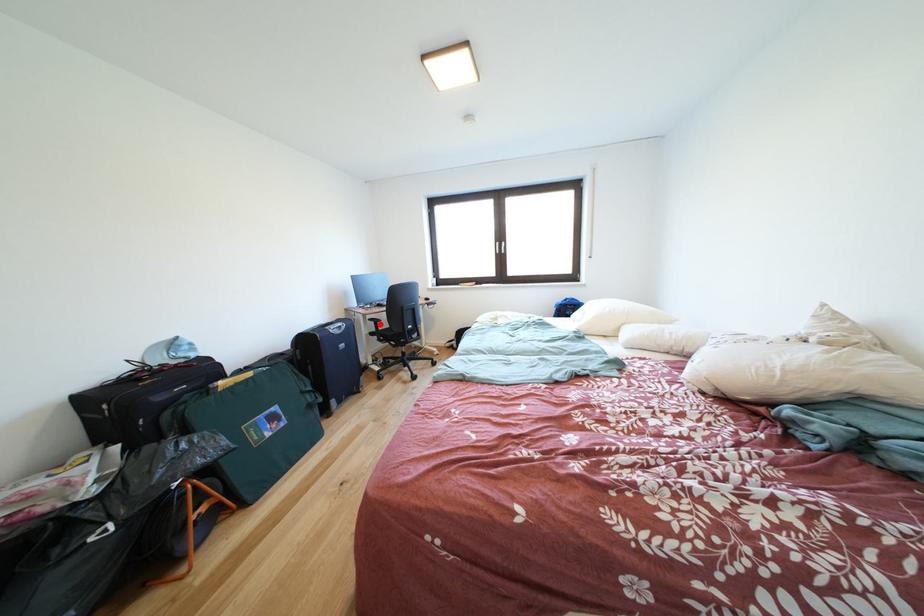
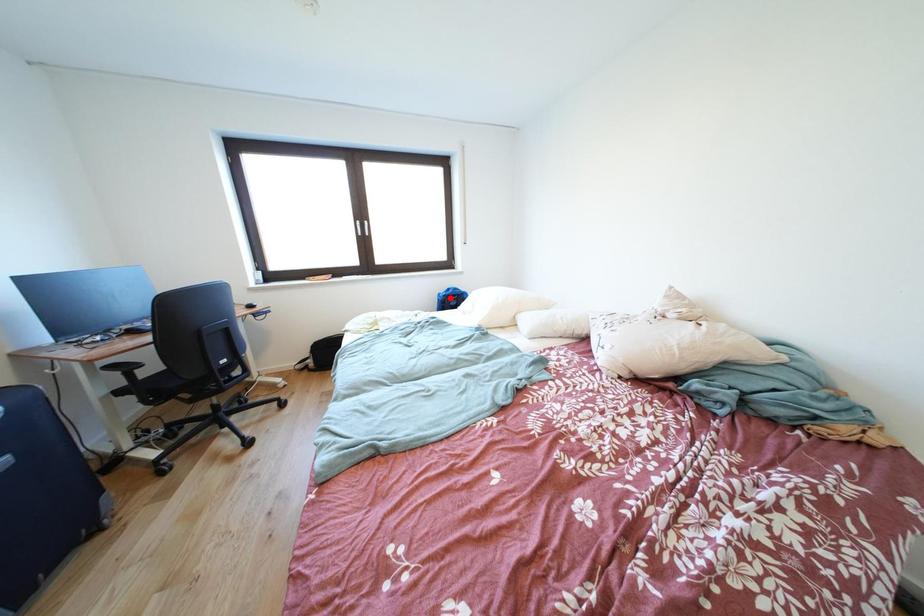
I am providing you with two images of the same scene from different viewpoints. A red point is marked on the first image and another point is marked on the second image. Do the highlighted points in image1 and image2 indicate the same real-world spot?

No